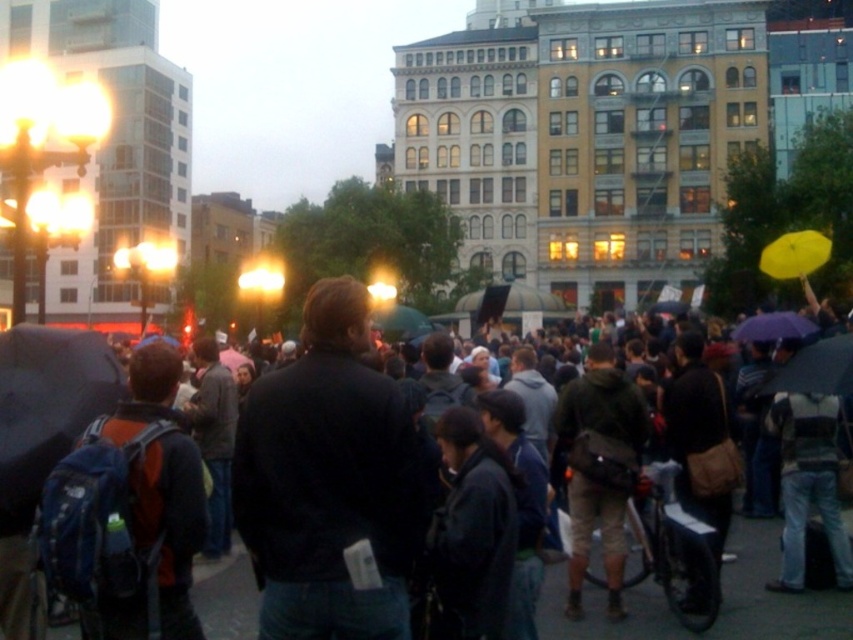
You are standing in the crowd in the public square and want to take a photo of both the point at location (831,355) and the point at (761,262). Which point should you focus on first to ensure both are in focus?

You should focus on point (761,262) first because it is farther from the camera than point (831,355). By focusing on the farther point, the closer point will also be within the depth of field, ensuring both are in focus.

You are a photographer standing in the middle of the plaza and want to capture the matte black umbrella at left in your shot. Based on its position, can you estimate whether it is on the left or right side of the frame?

The matte black umbrella at left is located at point coordinates of [47,406]. Since the x coordinate is 0.637, which is closer to 1 than to 0, this places it on the right side of the frame. However, the object label explicitly states it is at the left, so there might be a discrepancy. But according to the coordinates, it should be on the right. Wait, perhaps the coordinate system has [0,0] at the top left? If so, then 0.637 on the x axis would mean it is on the right side. Therefore, the answer is that it

You are a photographer standing at the edge of the plaza, trying to capture a shot that includes both the matte black umbrella at left and the matte purple umbrella at center. Given that your camera has a maximum zoom range of 60 meters, will you be able to frame both umbrellas in a single shot without moving closer?

The matte black umbrella at left is 59.95 meters from the matte purple umbrella at center. Since the distance between them is just under 60 meters, your camera can capture both in a single shot with its maximum zoom range of 60 meters.